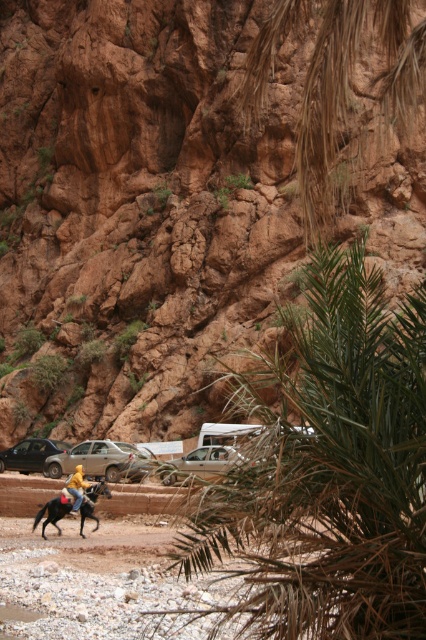
Does green leafy palm tree at center appear over silver metallic car at lower left?

Correct, green leafy palm tree at center is located above silver metallic car at lower left.

Does green leafy palm tree at center have a lesser width compared to silver metallic car at lower left?

No.

At what (x,y) coordinates should I click in order to perform the action: click on green leafy palm tree at center. Please return your answer as a coordinate pair (x, y). Looking at the image, I should click on (330, 468).

Locate an element on the screen. The width and height of the screenshot is (426, 640). green leafy palm tree at center is located at coordinates (330, 468).

Who is positioned more to the left, brown rough rock at upper center or matte black car at left?

From the viewer's perspective, brown rough rock at upper center appears more on the left side.

Between point (196, 61) and point (2, 468), which one is positioned in front?

Positioned in front is point (2, 468).

The image size is (426, 640). I want to click on brown rough rock at upper center, so click(135, 211).

Does brown rough rock at upper center have a larger size compared to silver metallic car at center?

Yes, brown rough rock at upper center is bigger than silver metallic car at center.

Is point (94, 230) behind point (201, 477)?

Yes, it is behind point (201, 477).

In order to click on brown rough rock at upper center in this screenshot , I will do `click(135, 211)`.

You are a GUI agent. You are given a task and a screenshot of the screen. Output one action in this format:
    pyautogui.click(x=<x>, y=<y>)
    Task: Click on the brown rough rock at upper center
    The image size is (426, 640).
    Given the screenshot: What is the action you would take?
    pyautogui.click(x=135, y=211)